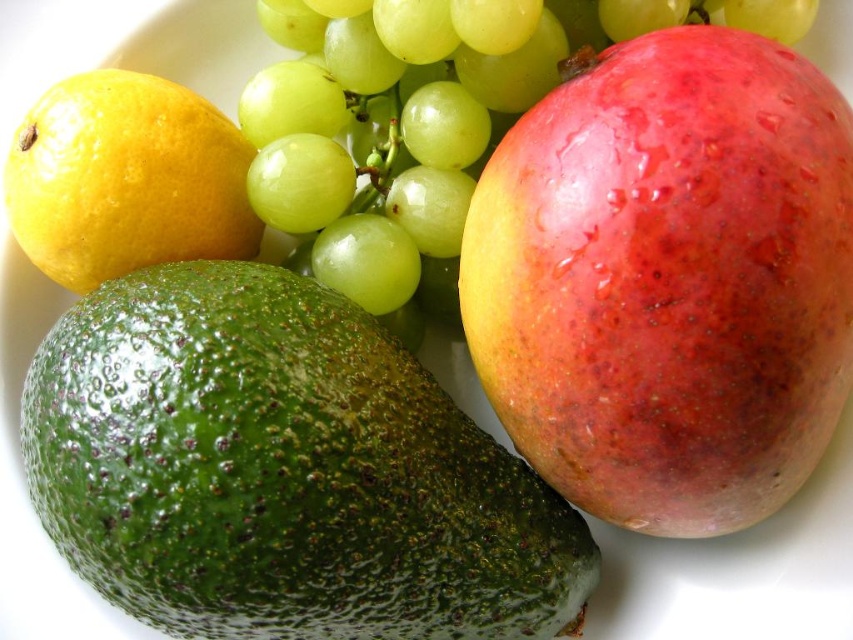
Question: Which point is closer to the camera?

Choices:
 (A) (222, 452)
 (B) (67, 134)
 (C) (477, 328)

Answer: (A)

Question: Can you confirm if green rough avocado at lower left is positioned above yellow matte lemon at upper left?

Choices:
 (A) yes
 (B) no

Answer: (B)

Question: Does shiny red mango at right have a lesser width compared to green rough avocado at lower left?

Choices:
 (A) no
 (B) yes

Answer: (B)

Question: Does shiny red mango at right appear over yellow matte lemon at upper left?

Choices:
 (A) yes
 (B) no

Answer: (B)

Question: Which of the following is the closest to the observer?

Choices:
 (A) (448, 291)
 (B) (24, 179)
 (C) (766, 493)
 (D) (543, 586)

Answer: (C)

Question: Among these points, which one is nearest to the camera?

Choices:
 (A) (809, 176)
 (B) (212, 362)
 (C) (36, 152)
 (D) (418, 211)

Answer: (A)